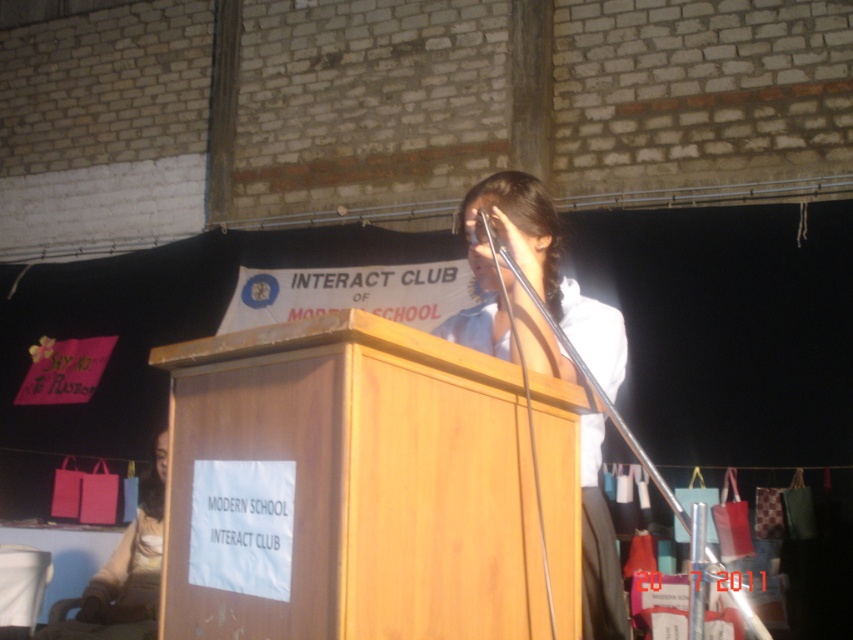
Question: Does white glossy shirt at center appear on the left side of metallic shiny microphone at upper center?

Choices:
 (A) no
 (B) yes

Answer: (A)

Question: Does white glossy shirt at center have a larger size compared to metallic shiny microphone at upper center?

Choices:
 (A) yes
 (B) no

Answer: (A)

Question: Which point is closer to the camera taking this photo?

Choices:
 (A) (505, 291)
 (B) (488, 236)

Answer: (A)

Question: Which object appears closest to the camera in this image?

Choices:
 (A) white glossy shirt at center
 (B) metallic shiny microphone at upper center

Answer: (A)

Question: Does white glossy shirt at center have a lesser width compared to metallic shiny microphone at upper center?

Choices:
 (A) no
 (B) yes

Answer: (A)